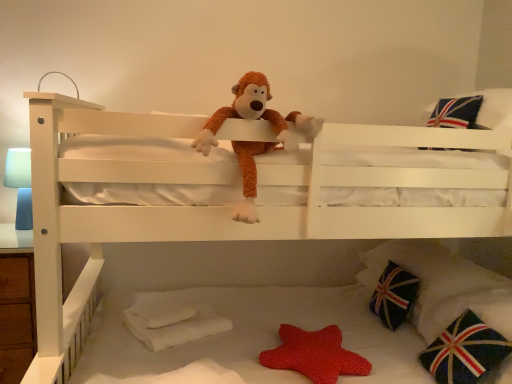
The width and height of the screenshot is (512, 384). Describe the element at coordinates (494, 108) in the screenshot. I see `union jack fabric pillow at upper right, which is the fourth pillow from bottom to top` at that location.

This screenshot has width=512, height=384. What do you see at coordinates (256, 115) in the screenshot?
I see `fluffy brown monkey at center, the first toy when ordered from top to bottom` at bounding box center [256, 115].

Describe the element at coordinates (394, 295) in the screenshot. I see `dark blue fabric pillow with union jack design at lower right, the third pillow in the top-to-bottom sequence` at that location.

Where is `soft plush monkey at center`? Image resolution: width=512 pixels, height=384 pixels. soft plush monkey at center is located at coordinates click(228, 207).

Find the location of a particular element. The image size is (512, 384). red dotted fabric star at lower center, the 2th toy positioned from the top is located at coordinates (314, 355).

Locate an element on the screen. The image size is (512, 384). blue matte table lamp at left is located at coordinates (20, 185).

Where is `union jack fabric pillow at upper right, which is the fourth pillow from bottom to top`? Image resolution: width=512 pixels, height=384 pixels. union jack fabric pillow at upper right, which is the fourth pillow from bottom to top is located at coordinates (494, 108).

From a real-world perspective, is fluffy brown monkey at center, positioned as the 1th toy in front-to-back order, on top of dark blue fabric pillow with union jack design at lower right, arranged as the 3th pillow when ordered from the bottom?

Yes, from a real-world perspective, fluffy brown monkey at center, positioned as the 1th toy in front-to-back order, is above dark blue fabric pillow with union jack design at lower right, arranged as the 3th pillow when ordered from the bottom.

In the scene shown: Considering the sizes of fluffy brown monkey at center, the 2th toy in the back-to-front sequence, and dark blue fabric pillow with union jack design at lower right, the second pillow when ordered from top to bottom, in the image, is fluffy brown monkey at center, the 2th toy in the back-to-front sequence, taller or shorter than dark blue fabric pillow with union jack design at lower right, the second pillow when ordered from top to bottom,?

In the image, fluffy brown monkey at center, the 2th toy in the back-to-front sequence, appears to be taller than dark blue fabric pillow with union jack design at lower right, the second pillow when ordered from top to bottom.

Is fluffy brown monkey at center, the second toy ordered from the bottom, looking in the opposite direction of dark blue fabric pillow with union jack design at lower right, the second pillow when ordered from top to bottom?

No, fluffy brown monkey at center, the second toy ordered from the bottom, is not facing the opposite direction of dark blue fabric pillow with union jack design at lower right, the second pillow when ordered from top to bottom.

From the picture: Considering the positions of objects dark blue fabric pillow with union jack design at lower right, arranged as the 3th pillow when ordered from the bottom, and red dotted fabric star at lower center, the second toy from the front, in the image provided, who is in front, dark blue fabric pillow with union jack design at lower right, arranged as the 3th pillow when ordered from the bottom, or red dotted fabric star at lower center, the second toy from the front,?

Positioned in front is red dotted fabric star at lower center, the second toy from the front.

From the red dotted fabric star at lower center, the second toy from the front, count 2nd pillows backward and point to it. Please provide its 2D coordinates.

[(443, 285)]

Would you consider dark blue fabric pillow with union jack design at lower right, the second pillow when ordered from top to bottom, to be distant from red dotted fabric star at lower center, the second toy from the front?

dark blue fabric pillow with union jack design at lower right, the second pillow when ordered from top to bottom, is actually quite close to red dotted fabric star at lower center, the second toy from the front.

Is dark blue fabric pillow with union jack design at lower right, which is the second pillow in bottom-to-top order, inside blue matte table lamp at left?

No, dark blue fabric pillow with union jack design at lower right, which is the second pillow in bottom-to-top order, is not inside blue matte table lamp at left.

How many degrees apart are the facing directions of blue matte table lamp at left and dark blue fabric pillow with union jack design at lower right, the third pillow in the top-to-bottom sequence?

blue matte table lamp at left and dark blue fabric pillow with union jack design at lower right, the third pillow in the top-to-bottom sequence, are facing 90.2 degrees away from each other.

Which is less distant, (19, 178) or (387, 314)?

Positioned in front is point (19, 178).

How far apart are blue matte table lamp at left and dark blue fabric pillow with union jack design at lower right, the third pillow in the top-to-bottom sequence?

The distance of blue matte table lamp at left from dark blue fabric pillow with union jack design at lower right, the third pillow in the top-to-bottom sequence, is 1.76 meters.

Which object is further away from the camera taking this photo, dark blue fabric pillow with union jack design at lower right, which is the second pillow in bottom-to-top order, or fluffy brown monkey at center, the second toy ordered from the bottom?

Positioned behind is dark blue fabric pillow with union jack design at lower right, which is the second pillow in bottom-to-top order.

From the image's perspective, who appears lower, dark blue fabric pillow with union jack design at lower right, which is the second pillow in bottom-to-top order, or fluffy brown monkey at center, the first toy when ordered from top to bottom?

From the image's view, dark blue fabric pillow with union jack design at lower right, which is the second pillow in bottom-to-top order, is below.

From a real-world perspective, does dark blue fabric pillow with union jack design at lower right, which is the second pillow in bottom-to-top order, sit lower than fluffy brown monkey at center, the second toy ordered from the bottom?

Yes.

Is point (13, 186) positioned after point (495, 91)?

Yes, point (13, 186) is farther from viewer.

Between blue matte table lamp at left and union jack fabric pillow at upper right, placed as the 1th pillow when sorted from top to bottom, which one appears on the right side from the viewer's perspective?

Positioned to the right is union jack fabric pillow at upper right, placed as the 1th pillow when sorted from top to bottom.

Would you say blue matte table lamp at left is a long distance from union jack fabric pillow at upper right, placed as the 1th pillow when sorted from top to bottom?

Yes, blue matte table lamp at left and union jack fabric pillow at upper right, placed as the 1th pillow when sorted from top to bottom, are located far from each other.

Is blue matte table lamp at left facing towards union jack fabric pillow at upper right, placed as the 1th pillow when sorted from top to bottom?

No, blue matte table lamp at left does not turn towards union jack fabric pillow at upper right, placed as the 1th pillow when sorted from top to bottom.

Is fluffy brown monkey at center, the second toy ordered from the bottom, positioned far away from soft plush monkey at center?

That's not correct — fluffy brown monkey at center, the second toy ordered from the bottom, is a little close to soft plush monkey at center.

Is fluffy brown monkey at center, positioned as the 1th toy in front-to-back order, facing towards soft plush monkey at center?

Yes, fluffy brown monkey at center, positioned as the 1th toy in front-to-back order, is aimed at soft plush monkey at center.

Can you tell me how much fluffy brown monkey at center, positioned as the 1th toy in front-to-back order, and soft plush monkey at center differ in facing direction?

88.1 degrees separate the facing orientations of fluffy brown monkey at center, positioned as the 1th toy in front-to-back order, and soft plush monkey at center.

Image resolution: width=512 pixels, height=384 pixels. I want to click on the 1st toy behind the soft plush monkey at center, so click(256, 115).

Is union jack fabric pillow at upper right, which is the fourth pillow from bottom to top, facing away from dark blue fabric pillow with union jack design at lower right, the second pillow when ordered from top to bottom?

No, dark blue fabric pillow with union jack design at lower right, the second pillow when ordered from top to bottom, is not at the back of union jack fabric pillow at upper right, which is the fourth pillow from bottom to top.

Is union jack fabric pillow at upper right, placed as the 1th pillow when sorted from top to bottom, spatially inside dark blue fabric pillow with union jack design at lower right, arranged as the 3th pillow when ordered from the bottom, or outside of it?

union jack fabric pillow at upper right, placed as the 1th pillow when sorted from top to bottom, cannot be found inside dark blue fabric pillow with union jack design at lower right, arranged as the 3th pillow when ordered from the bottom.

From the image's perspective, is union jack fabric pillow at upper right, which is the fourth pillow from bottom to top, over dark blue fabric pillow with union jack design at lower right, the second pillow when ordered from top to bottom?

Correct, union jack fabric pillow at upper right, which is the fourth pillow from bottom to top, appears higher than dark blue fabric pillow with union jack design at lower right, the second pillow when ordered from top to bottom, in the image.

Is union jack fabric pillow at upper right, which is the fourth pillow from bottom to top, further to the viewer compared to dark blue fabric pillow with union jack design at lower right, arranged as the 3th pillow when ordered from the bottom?

That is False.

Where is `toy above the dark blue fabric pillow with union jack design at lower right, the second pillow when ordered from top to bottom (from the image's perspective)`? toy above the dark blue fabric pillow with union jack design at lower right, the second pillow when ordered from top to bottom (from the image's perspective) is located at coordinates (256, 115).

Starting from the red dotted fabric star at lower center, the 2th toy positioned from the top, which pillow is the 2nd one behind? Please provide its 2D coordinates.

[(443, 285)]

Looking at the image, which one is located further to fluffy brown monkey at center, the first toy when ordered from top to bottom, red dotted fabric star at lower center, which appears as the first toy when ordered from the bottom, or union jack fabric pillow at upper right, which is the fourth pillow from bottom to top?

union jack fabric pillow at upper right, which is the fourth pillow from bottom to top.

Based on their spatial positions, is fluffy brown monkey at center, positioned as the 1th toy in front-to-back order, or dark blue fabric pillow with union jack design at lower right, arranged as the 3th pillow when ordered from the bottom, further from union jack fabric pillow at upper right, which is the fourth pillow from bottom to top?

Based on the image, fluffy brown monkey at center, positioned as the 1th toy in front-to-back order, appears to be further to union jack fabric pillow at upper right, which is the fourth pillow from bottom to top.

When comparing their distances from soft plush monkey at center, does fluffy brown monkey at center, positioned as the 1th toy in front-to-back order, or dark blue fabric pillow with union jack design at lower right, which is the second pillow in bottom-to-top order, seem closer?

fluffy brown monkey at center, positioned as the 1th toy in front-to-back order, lies closer to soft plush monkey at center than the other object.

Which object lies further to the anchor point soft plush monkey at center, fluffy brown monkey at center, the second toy ordered from the bottom, or red dotted fabric star at lower center, the 2th toy positioned from the top?

red dotted fabric star at lower center, the 2th toy positioned from the top, is positioned further to the anchor soft plush monkey at center.

Which object lies further to the anchor point blue matte table lamp at left, dark blue fabric pillow with union jack design at lower right, arranged as the 3th pillow when ordered from the bottom, or dark blue fabric pillow with union jack design at lower right, the 4th pillow viewed from the top?

dark blue fabric pillow with union jack design at lower right, arranged as the 3th pillow when ordered from the bottom, is further to blue matte table lamp at left.

Which object lies further to the anchor point dark blue fabric pillow with union jack design at lower right, marked as the 1th pillow in a bottom-to-top arrangement, union jack fabric pillow at upper right, which is the fourth pillow from bottom to top, or dark blue fabric pillow with union jack design at lower right, the second pillow when ordered from top to bottom?

union jack fabric pillow at upper right, which is the fourth pillow from bottom to top, lies further to dark blue fabric pillow with union jack design at lower right, marked as the 1th pillow in a bottom-to-top arrangement, than the other object.

Considering their positions, is dark blue fabric pillow with union jack design at lower right, the second pillow when ordered from top to bottom, positioned closer to red dotted fabric star at lower center, the 1th toy from the back, than dark blue fabric pillow with union jack design at lower right, the third pillow in the top-to-bottom sequence?

dark blue fabric pillow with union jack design at lower right, the third pillow in the top-to-bottom sequence, is closer to red dotted fabric star at lower center, the 1th toy from the back.

When comparing their distances from fluffy brown monkey at center, the second toy ordered from the bottom, does union jack fabric pillow at upper right, which is the fourth pillow from bottom to top, or dark blue fabric pillow with union jack design at lower right, the 4th pillow viewed from the top, seem closer?

The object closer to fluffy brown monkey at center, the second toy ordered from the bottom, is union jack fabric pillow at upper right, which is the fourth pillow from bottom to top.

Where is `bed between blue matte table lamp at left and dark blue fabric pillow with union jack design at lower right, the 4th pillow viewed from the top, in the horizontal direction`? Image resolution: width=512 pixels, height=384 pixels. bed between blue matte table lamp at left and dark blue fabric pillow with union jack design at lower right, the 4th pillow viewed from the top, in the horizontal direction is located at coordinates 228,207.

Find the location of a particular element. bed between fluffy brown monkey at center, positioned as the 1th toy in front-to-back order, and dark blue fabric pillow with union jack design at lower right, marked as the 1th pillow in a bottom-to-top arrangement is located at coordinates (228, 207).

The height and width of the screenshot is (384, 512). Find the location of `bed between union jack fabric pillow at upper right, placed as the 1th pillow when sorted from top to bottom, and red dotted fabric star at lower center, the 1th toy from the back, from top to bottom`. bed between union jack fabric pillow at upper right, placed as the 1th pillow when sorted from top to bottom, and red dotted fabric star at lower center, the 1th toy from the back, from top to bottom is located at coordinates (x=228, y=207).

Identify the location of toy between blue matte table lamp at left and red dotted fabric star at lower center, which appears as the first toy when ordered from the bottom, from left to right. The width and height of the screenshot is (512, 384). (256, 115).